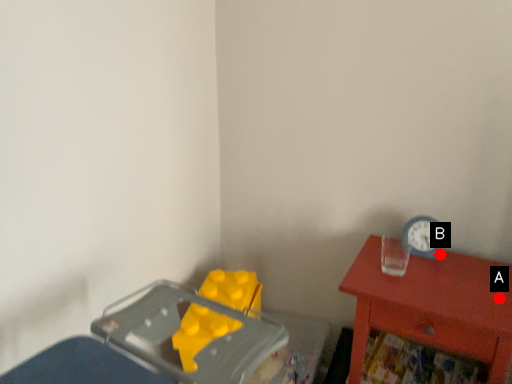
Question: Two points are circled on the image, labeled by A and B beside each circle. Which point is closer to the camera?

Choices:
 (A) A is closer
 (B) B is closer

Answer: (A)